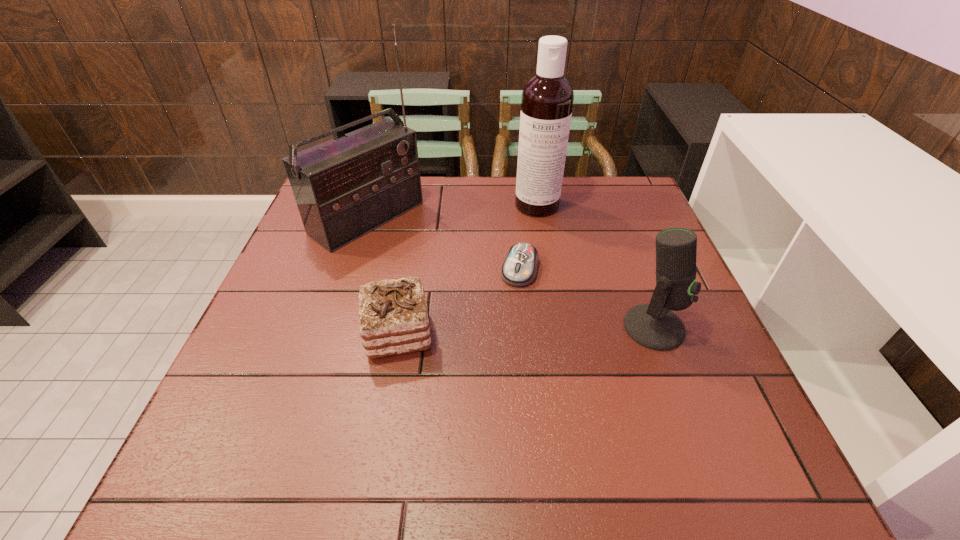
Locate an element on the screen. This screenshot has height=540, width=960. the fourth tallest object is located at coordinates (393, 314).

The image size is (960, 540). Identify the location of the third tallest object. pyautogui.click(x=654, y=326).

Locate an element on the screen. This screenshot has height=540, width=960. the rightmost object is located at coordinates (654, 326).

Find the location of a particular element. This screenshot has height=540, width=960. radio receiver is located at coordinates (345, 188).

Find the location of a particular element. This screenshot has width=960, height=540. dishwasher detergent is located at coordinates 547,99.

The image size is (960, 540). I want to click on the shortest object, so click(519, 269).

The height and width of the screenshot is (540, 960). Identify the location of vacant space situated on the right of the fourth tallest object. (536, 333).

At what (x,y) coordinates should I click in order to perform the action: click on free location located 0.140m on the back of the microphone. Please return your answer as a coordinate pair (x, y). Looking at the image, I should click on (631, 265).

Where is `vacant space located on the front panel of the radio receiver`? The height and width of the screenshot is (540, 960). vacant space located on the front panel of the radio receiver is located at coordinates (431, 261).

Locate an element on the screen. This screenshot has width=960, height=540. blank space located on the front panel of the radio receiver is located at coordinates (506, 310).